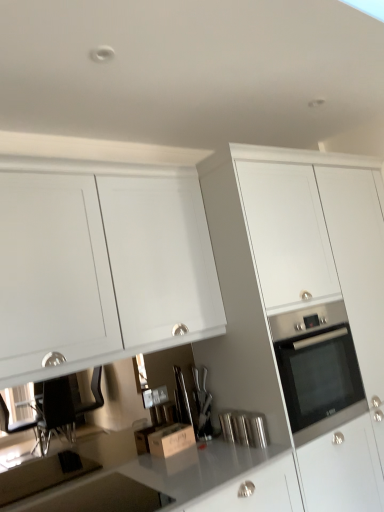
Question: Which direction should I rotate to look at satin silver knife block at center, which is counted as the 1th appliance, starting from the back?

Choices:
 (A) left
 (B) right

Answer: (A)

Question: From the image's perspective, does white glossy cabinet at center, the 1th cabinetry when ordered from right to left, appear lower than wooden cardboard box at center?

Choices:
 (A) no
 (B) yes

Answer: (A)

Question: Does white glossy cabinet at center, which is counted as the second cabinetry, starting from the left, appear on the right side of wooden cardboard box at center?

Choices:
 (A) no
 (B) yes

Answer: (B)

Question: Is white glossy cabinet at center, which is counted as the second cabinetry, starting from the left, positioned in front of wooden cardboard box at center?

Choices:
 (A) yes
 (B) no

Answer: (A)

Question: Are white glossy cabinet at center, the 1th cabinetry when ordered from right to left, and wooden cardboard box at center beside each other?

Choices:
 (A) no
 (B) yes

Answer: (A)

Question: Does white glossy cabinet at center, which is counted as the second cabinetry, starting from the left, have a greater width compared to wooden cardboard box at center?

Choices:
 (A) yes
 (B) no

Answer: (A)

Question: Is white glossy cabinet at center, the 1th cabinetry when ordered from right to left, oriented towards wooden cardboard box at center?

Choices:
 (A) no
 (B) yes

Answer: (A)

Question: Is white matte cabinet at upper left, acting as the second cabinetry starting from the right, not inside polished stainless steel canister at center, the second appliance from the left?

Choices:
 (A) yes
 (B) no

Answer: (A)

Question: From the image's perspective, does white matte cabinet at upper left, the first cabinetry from the left, appear higher than polished stainless steel canister at center, positioned as the 2th appliance in back-to-front order?

Choices:
 (A) yes
 (B) no

Answer: (A)

Question: Can you confirm if white matte cabinet at upper left, acting as the second cabinetry starting from the right, is bigger than polished stainless steel canister at center, which ranks as the 1th appliance in front-to-back order?

Choices:
 (A) yes
 (B) no

Answer: (A)

Question: Is white matte cabinet at upper left, acting as the second cabinetry starting from the right, further to camera compared to polished stainless steel canister at center, which appears as the 1th appliance when viewed from the right?

Choices:
 (A) no
 (B) yes

Answer: (A)

Question: From a real-world perspective, is white matte cabinet at upper left, the first cabinetry from the left, over polished stainless steel canister at center, positioned as the 2th appliance in back-to-front order?

Choices:
 (A) yes
 (B) no

Answer: (A)

Question: Is white matte cabinet at upper left, acting as the second cabinetry starting from the right, turned away from polished stainless steel canister at center, the second appliance from the left?

Choices:
 (A) yes
 (B) no

Answer: (B)

Question: Is polished stainless steel canister at center, which appears as the 1th appliance when viewed from the right, to the right of satin silver knife block at center, marked as the second appliance in a front-to-back arrangement, from the viewer's perspective?

Choices:
 (A) yes
 (B) no

Answer: (A)